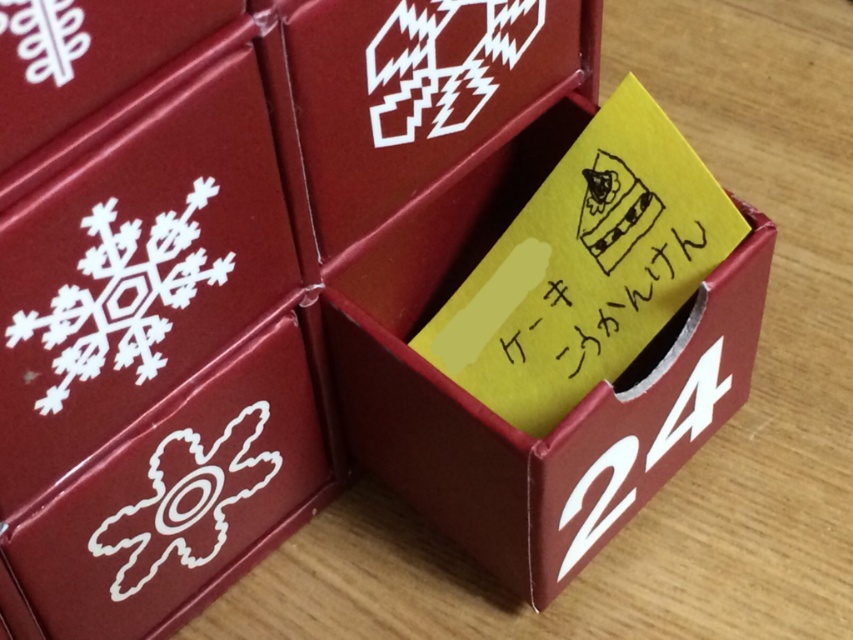
Question: Does matte red box at center appear on the left side of yellow paper at center?

Choices:
 (A) yes
 (B) no

Answer: (A)

Question: Estimate the real-world distances between objects in this image. Which object is farther from the matte paper box at center?

Choices:
 (A) matte red box at center
 (B) yellow paper at center

Answer: (A)

Question: Can you confirm if matte paper box at center is thinner than matte red box at center?

Choices:
 (A) no
 (B) yes

Answer: (A)

Question: Is matte paper box at center bigger than yellow paper at center?

Choices:
 (A) no
 (B) yes

Answer: (B)

Question: Which object appears farthest from the camera in this image?

Choices:
 (A) matte paper box at center
 (B) yellow paper at center
 (C) white paper snowflake at left
 (D) matte red box at center

Answer: (B)

Question: Among these objects, which one is farthest from the camera?

Choices:
 (A) yellow paper at center
 (B) matte paper box at center
 (C) matte red box at center

Answer: (A)